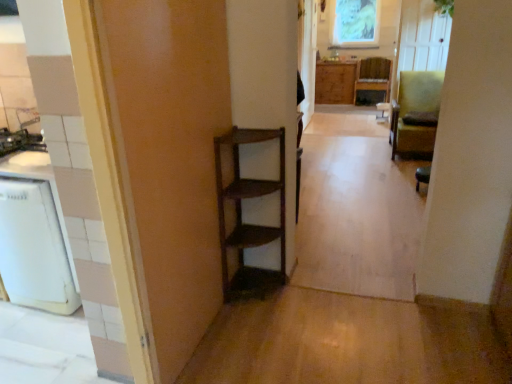
Question: From the image's perspective, does wooden chair at center, the first chair positioned from the top, appear lower than green fabric chair at right, the second chair from the back?

Choices:
 (A) yes
 (B) no

Answer: (B)

Question: Does wooden chair at center, acting as the first chair starting from the back, appear on the right side of green fabric chair at right, arranged as the 2th chair when viewed from the front?

Choices:
 (A) no
 (B) yes

Answer: (B)

Question: Is wooden chair at center, the third chair from the front, taller than green fabric chair at right, arranged as the 2th chair when viewed from the front?

Choices:
 (A) yes
 (B) no

Answer: (B)

Question: Considering the relative positions of wooden chair at center, the third chair from the front, and green fabric chair at right, arranged as the 2th chair when viewed from the front, in the image provided, is wooden chair at center, the third chair from the front, behind green fabric chair at right, arranged as the 2th chair when viewed from the front,?

Choices:
 (A) yes
 (B) no

Answer: (A)

Question: Is wooden chair at center, the first chair positioned from the top, outside green fabric chair at right, arranged as the 2th chair when viewed from the front?

Choices:
 (A) yes
 (B) no

Answer: (A)

Question: Relative to green fabric chair at right, the 2th chair when ordered from top to bottom, is wooden chair at center, the third chair from the front, in front or behind?

Choices:
 (A) behind
 (B) front

Answer: (A)

Question: Choose the correct answer: Is wooden chair at center, the third chair from the front, inside green fabric chair at right, arranged as the 2th chair when viewed from the front, or outside it?

Choices:
 (A) inside
 (B) outside

Answer: (B)

Question: In terms of size, does wooden chair at center, acting as the first chair starting from the back, appear bigger or smaller than green fabric chair at right, the 2th chair in the bottom-to-top sequence?

Choices:
 (A) big
 (B) small

Answer: (B)

Question: Considering the relative positions of wooden chair at center, the third chair from the front, and green fabric chair at right, the 2th chair in the bottom-to-top sequence, in the image provided, is wooden chair at center, the third chair from the front, to the left or to the right of green fabric chair at right, the 2th chair in the bottom-to-top sequence,?

Choices:
 (A) right
 (B) left

Answer: (A)

Question: From the image's perspective, is wooden chair at center, which appears as the 3th chair when ordered from the bottom, located above or below wooden shelf at center?

Choices:
 (A) below
 (B) above

Answer: (B)

Question: Looking at the image, does wooden chair at center, the first chair positioned from the top, seem bigger or smaller compared to wooden shelf at center?

Choices:
 (A) big
 (B) small

Answer: (A)

Question: Is wooden chair at center, the first chair positioned from the top, wider or thinner than wooden shelf at center?

Choices:
 (A) thin
 (B) wide

Answer: (B)

Question: Is wooden chair at center, the third chair from the front, in front of or behind wooden shelf at center in the image?

Choices:
 (A) front
 (B) behind

Answer: (B)

Question: Considering the positions of point (364, 79) and point (350, 99), is point (364, 79) closer or farther from the camera than point (350, 99)?

Choices:
 (A) closer
 (B) farther

Answer: (A)

Question: Is wooden chair at center, the third chair from the front, wider or thinner than wooden cabinet at center?

Choices:
 (A) wide
 (B) thin

Answer: (A)